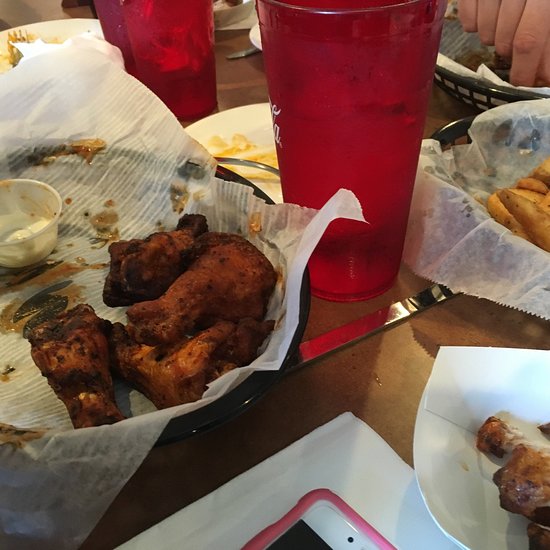
What are the coordinates of `red cup` in the screenshot? It's located at (365, 152).